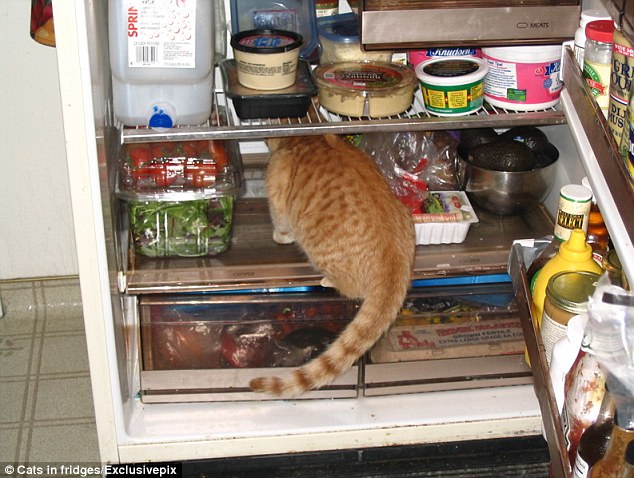
Where is `refrigerator`? This screenshot has height=478, width=634. refrigerator is located at coordinates (94, 207).